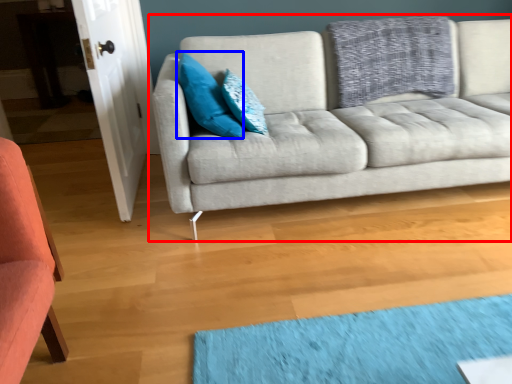
Question: Which object appears farthest to the camera in this image, studio couch (highlighted by a red box) or pillow (highlighted by a blue box)?

Choices:
 (A) studio couch
 (B) pillow

Answer: (B)